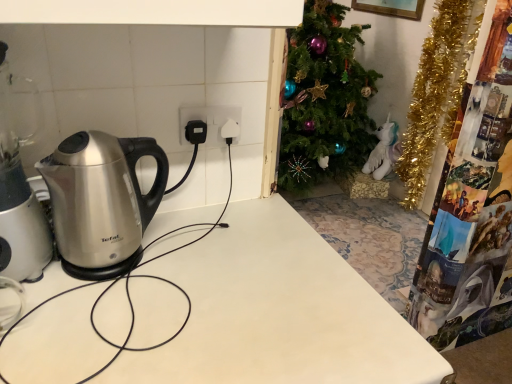
Question: Considering the relative sizes of satin silver kettle at left and white plastic socket at center in the image provided, is satin silver kettle at left shorter than white plastic socket at center?

Choices:
 (A) yes
 (B) no

Answer: (B)

Question: Can you confirm if satin silver kettle at left is wider than white plastic socket at center?

Choices:
 (A) yes
 (B) no

Answer: (A)

Question: Is white plastic socket at center at the back of satin silver kettle at left?

Choices:
 (A) no
 (B) yes

Answer: (A)

Question: Is satin silver kettle at left not within white plastic socket at center?

Choices:
 (A) no
 (B) yes

Answer: (B)

Question: Would you say satin silver kettle at left contains white plastic socket at center?

Choices:
 (A) yes
 (B) no

Answer: (B)

Question: Based on their sizes in the image, would you say white plastic socket at center is bigger or smaller than white glossy table at center?

Choices:
 (A) big
 (B) small

Answer: (B)

Question: Is white plastic socket at center taller or shorter than white glossy table at center?

Choices:
 (A) tall
 (B) short

Answer: (B)

Question: Is point (181, 140) positioned closer to the camera than point (53, 268)?

Choices:
 (A) farther
 (B) closer

Answer: (A)

Question: Is white plastic socket at center situated inside white glossy table at center or outside?

Choices:
 (A) inside
 (B) outside

Answer: (B)

Question: Would you say white glossy table at center is to the left or to the right of white plastic socket at center in the picture?

Choices:
 (A) left
 (B) right

Answer: (A)

Question: Which is correct: white glossy table at center is inside white plastic socket at center, or outside of it?

Choices:
 (A) inside
 (B) outside

Answer: (B)

Question: From the image's perspective, relative to white plastic socket at center, is white glossy table at center above or below?

Choices:
 (A) below
 (B) above

Answer: (A)

Question: From a real-world perspective, is white glossy table at center physically located above or below white plastic socket at center?

Choices:
 (A) above
 (B) below

Answer: (B)

Question: Is white glossy table at center inside or outside of satin silver kettle at left?

Choices:
 (A) outside
 (B) inside

Answer: (A)

Question: Relative to satin silver kettle at left, is white glossy table at center in front or behind?

Choices:
 (A) behind
 (B) front

Answer: (B)